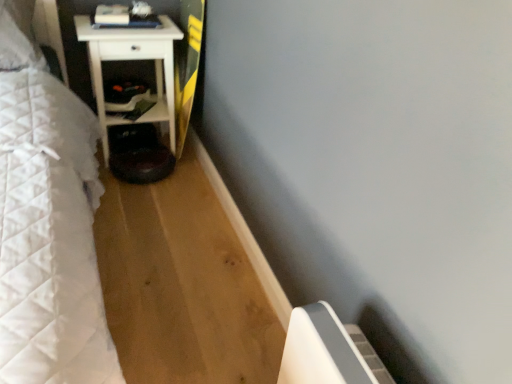
Question: Is shiny black step stool at lower center oriented away from white matte nightstand at left?

Choices:
 (A) no
 (B) yes

Answer: (B)

Question: Is shiny black step stool at lower center at the right side of white matte nightstand at left?

Choices:
 (A) yes
 (B) no

Answer: (A)

Question: From the image's perspective, is shiny black step stool at lower center over white matte nightstand at left?

Choices:
 (A) yes
 (B) no

Answer: (B)

Question: Does shiny black step stool at lower center have a lesser width compared to white matte nightstand at left?

Choices:
 (A) yes
 (B) no

Answer: (A)

Question: Would you say shiny black step stool at lower center is a long distance from white matte nightstand at left?

Choices:
 (A) yes
 (B) no

Answer: (B)

Question: Is matte black shelf at lower left wider or thinner than yellow-green wood longboard at center?

Choices:
 (A) thin
 (B) wide

Answer: (B)

Question: Is point (162, 84) closer or farther from the camera than point (178, 109)?

Choices:
 (A) farther
 (B) closer

Answer: (A)

Question: Is matte black shelf at lower left taller or shorter than yellow-green wood longboard at center?

Choices:
 (A) tall
 (B) short

Answer: (B)

Question: From a real-world perspective, is matte black shelf at lower left above or below yellow-green wood longboard at center?

Choices:
 (A) above
 (B) below

Answer: (B)

Question: In terms of height, does yellow-green wood longboard at center look taller or shorter compared to white matte nightstand at left?

Choices:
 (A) tall
 (B) short

Answer: (A)

Question: From the image's perspective, is yellow-green wood longboard at center above or below white matte nightstand at left?

Choices:
 (A) above
 (B) below

Answer: (A)

Question: Is point (187, 16) closer or farther from the camera than point (103, 99)?

Choices:
 (A) closer
 (B) farther

Answer: (A)

Question: From a real-world perspective, relative to white matte nightstand at left, is yellow-green wood longboard at center vertically above or below?

Choices:
 (A) below
 (B) above

Answer: (B)

Question: Considering the positions of point (117, 44) and point (166, 152), is point (117, 44) closer or farther from the camera than point (166, 152)?

Choices:
 (A) closer
 (B) farther

Answer: (A)

Question: From a real-world perspective, is white matte nightstand at left physically located above or below shiny black step stool at lower center?

Choices:
 (A) below
 (B) above

Answer: (B)